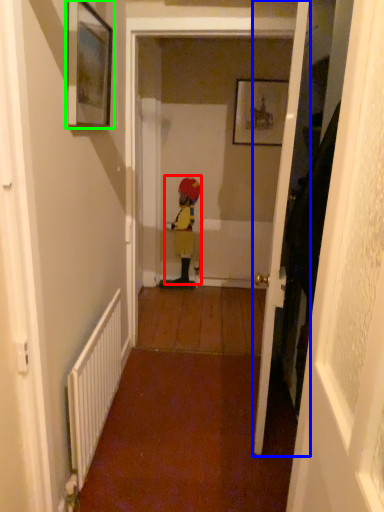
Question: Which object is positioned farthest from person (highlighted by a red box)? Select from door (highlighted by a blue box) and picture frame (highlighted by a green box).

Choices:
 (A) door
 (B) picture frame

Answer: (B)